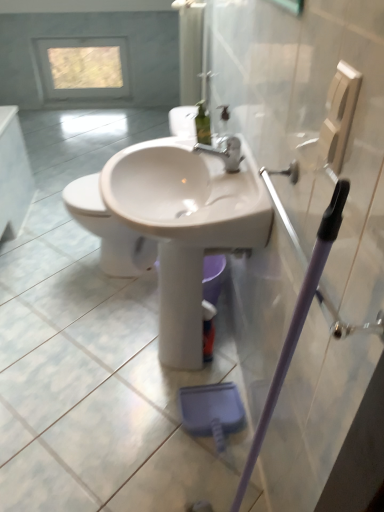
Identify the location of vacant space that's between white glossy sink at center and white glossy toilet at center. This screenshot has width=384, height=512. (109, 330).